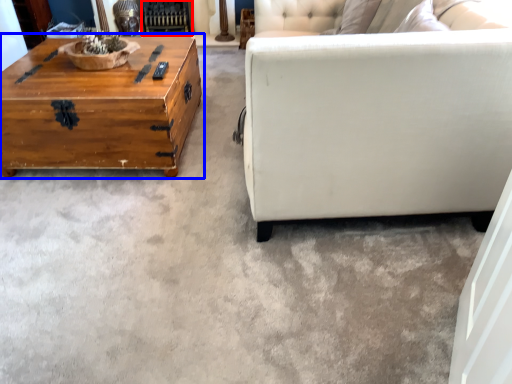
Question: Which object appears closest to the camera in this image, fireplace (highlighted by a red box) or coffee table (highlighted by a blue box)?

Choices:
 (A) fireplace
 (B) coffee table

Answer: (B)